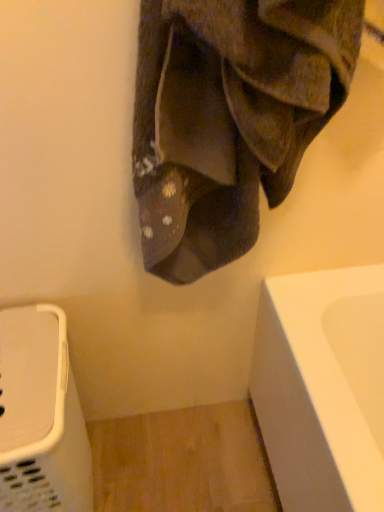
This screenshot has width=384, height=512. I want to click on brown suede shoes at upper center, so (229, 117).

This screenshot has width=384, height=512. What do you see at coordinates (229, 117) in the screenshot?
I see `brown suede shoes at upper center` at bounding box center [229, 117].

Where is `white plastic laundry basket at lower left`? white plastic laundry basket at lower left is located at coordinates (41, 416).

This screenshot has width=384, height=512. Describe the element at coordinates (41, 416) in the screenshot. I see `white plastic laundry basket at lower left` at that location.

What is the approximate width of white plastic laundry basket at lower left?

It is 14.19 inches.

Identify the location of brown suede shoes at upper center. This screenshot has height=512, width=384. (229, 117).

Is white plastic laundry basket at lower left to the left of brown suede shoes at upper center from the viewer's perspective?

Yes.

In the scene shown: Between white plastic laundry basket at lower left and brown suede shoes at upper center, which one is positioned in front?

brown suede shoes at upper center is more forward.

Which is farther from the camera, [61,446] or [244,54]?

Point [61,446]

From the image's perspective, which one is positioned lower, white plastic laundry basket at lower left or brown suede shoes at upper center?

From the image's view, white plastic laundry basket at lower left is below.

From a real-world perspective, is white plastic laundry basket at lower left located higher than brown suede shoes at upper center?

No.

Is white plastic laundry basket at lower left thinner than brown suede shoes at upper center?

In fact, white plastic laundry basket at lower left might be wider than brown suede shoes at upper center.

Can you confirm if white plastic laundry basket at lower left is shorter than brown suede shoes at upper center?

Incorrect, the height of white plastic laundry basket at lower left does not fall short of that of brown suede shoes at upper center.

Does white plastic laundry basket at lower left have a larger size compared to brown suede shoes at upper center?

Indeed, white plastic laundry basket at lower left has a larger size compared to brown suede shoes at upper center.

Is white plastic laundry basket at lower left located outside brown suede shoes at upper center?

white plastic laundry basket at lower left is positioned outside brown suede shoes at upper center.

Is white plastic laundry basket at lower left far away from brown suede shoes at upper center?

white plastic laundry basket at lower left is near brown suede shoes at upper center, not far away.

Is white plastic laundry basket at lower left oriented towards brown suede shoes at upper center?

No, white plastic laundry basket at lower left is not facing towards brown suede shoes at upper center.

In the scene shown: How many degrees apart are the facing directions of white plastic laundry basket at lower left and brown suede shoes at upper center?

The facing directions of white plastic laundry basket at lower left and brown suede shoes at upper center are 0.95 degrees apart.

Locate an element on the screen. This screenshot has height=512, width=384. towel in front of the white plastic laundry basket at lower left is located at coordinates (229, 117).

From the picture: Which is more to the left, brown suede shoes at upper center or white plastic laundry basket at lower left?

From the viewer's perspective, white plastic laundry basket at lower left appears more on the left side.

Which object is further away from the camera taking this photo, brown suede shoes at upper center or white plastic laundry basket at lower left?

white plastic laundry basket at lower left.

In the scene shown: Which point is more distant from viewer, (195,30) or (0,368)?

Point (0,368)

From the image's perspective, is brown suede shoes at upper center below white plastic laundry basket at lower left?

No, from the image's perspective, brown suede shoes at upper center is not below white plastic laundry basket at lower left.

From a real-world perspective, is brown suede shoes at upper center physically located above or below white plastic laundry basket at lower left?

From a real-world perspective, brown suede shoes at upper center is physically above white plastic laundry basket at lower left.

Based on the photo, is brown suede shoes at upper center wider or thinner than white plastic laundry basket at lower left?

In the image, brown suede shoes at upper center appears to be more narrow than white plastic laundry basket at lower left.

Is brown suede shoes at upper center taller than white plastic laundry basket at lower left?

No.

Is brown suede shoes at upper center bigger or smaller than white plastic laundry basket at lower left?

brown suede shoes at upper center is smaller than white plastic laundry basket at lower left.

Is white plastic laundry basket at lower left a part of brown suede shoes at upper center?

No, white plastic laundry basket at lower left is not a part of brown suede shoes at upper center.

Is brown suede shoes at upper center in contact with white plastic laundry basket at lower left?

No, brown suede shoes at upper center is not beside white plastic laundry basket at lower left.

Could you tell me if brown suede shoes at upper center is turned towards white plastic laundry basket at lower left?

No, brown suede shoes at upper center is not aimed at white plastic laundry basket at lower left.

Locate an element on the screen. towel to the right of white plastic laundry basket at lower left is located at coordinates (229, 117).

Locate an element on the screen. This screenshot has height=512, width=384. towel on the right of white plastic laundry basket at lower left is located at coordinates (229, 117).

Where is `appliance lying on the left of brown suede shoes at upper center`? appliance lying on the left of brown suede shoes at upper center is located at coordinates pyautogui.click(x=41, y=416).